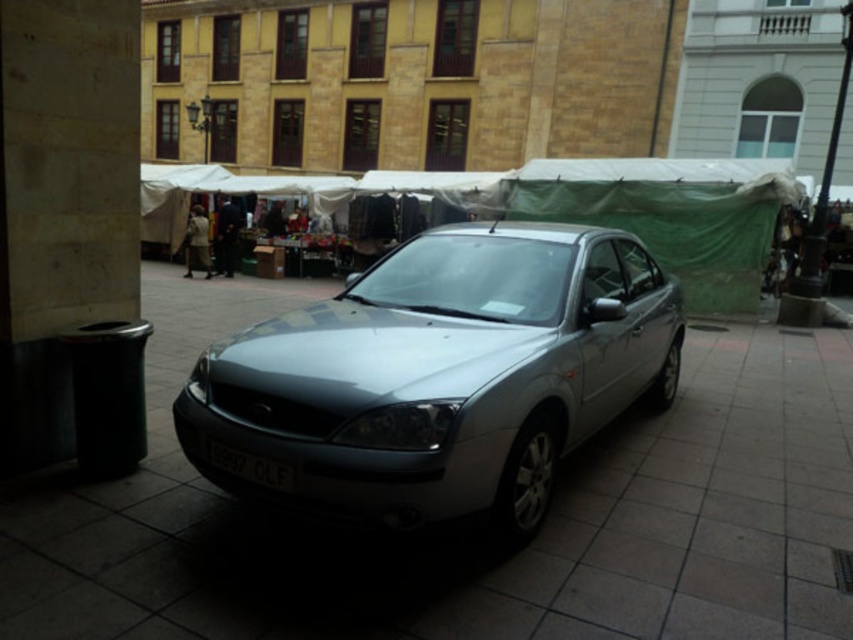
Question: Among these objects, which one is nearest to the camera?

Choices:
 (A) satin silver car at center
 (B) white plastic license plate at center

Answer: (A)

Question: Is slate gray pavement at center smaller than white plastic license plate at center?

Choices:
 (A) yes
 (B) no

Answer: (B)

Question: Is the position of slate gray pavement at center less distant than that of satin silver car at center?

Choices:
 (A) yes
 (B) no

Answer: (A)

Question: Which object appears farthest from the camera in this image?

Choices:
 (A) satin silver car at center
 (B) white plastic license plate at center
 (C) slate gray pavement at center

Answer: (B)

Question: Does satin silver car at center appear over white plastic license plate at center?

Choices:
 (A) no
 (B) yes

Answer: (B)

Question: Which of these objects is positioned closest to the satin silver car at center?

Choices:
 (A) slate gray pavement at center
 (B) white plastic license plate at center

Answer: (A)